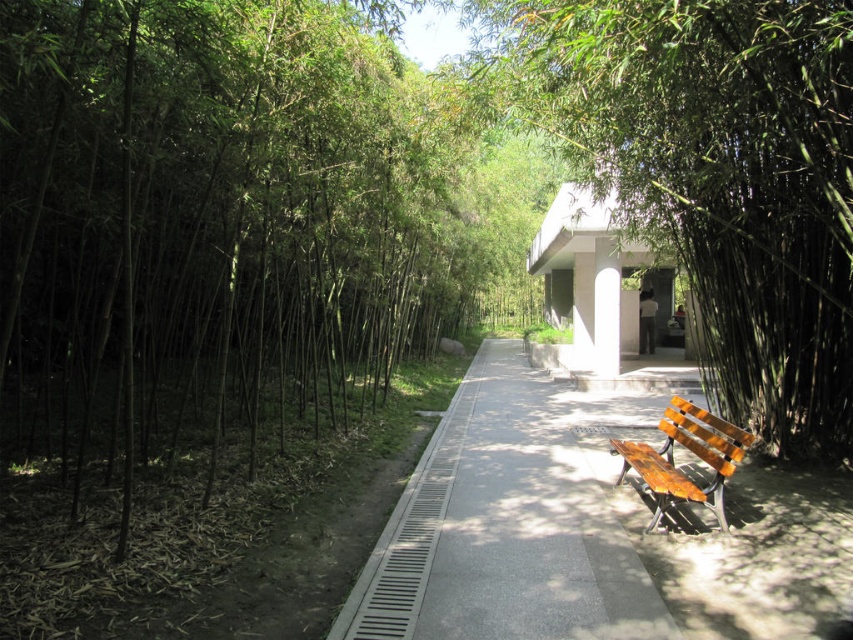
Locate an element on the screen. green matte bench at center is located at coordinates (712, 173).

Between point (821, 253) and point (730, 454), which one is positioned in front?

Point (730, 454) is more forward.

The image size is (853, 640). In order to click on green matte bench at center in this screenshot , I will do `click(712, 173)`.

Is green matte bench at center positioned in front of smooth concrete pavement at center?

Yes, green matte bench at center is closer to the viewer.

Locate an element on the screen. green matte bench at center is located at coordinates (712, 173).

Consider the image. Is smooth concrete pavement at center smaller than wooden bench at lower right?

No.

Looking at this image, can you confirm if smooth concrete pavement at center is positioned above wooden bench at lower right?

No, smooth concrete pavement at center is not above wooden bench at lower right.

Which is in front, point (601, 540) or point (701, 500)?

Point (701, 500)

The image size is (853, 640). I want to click on smooth concrete pavement at center, so click(589, 531).